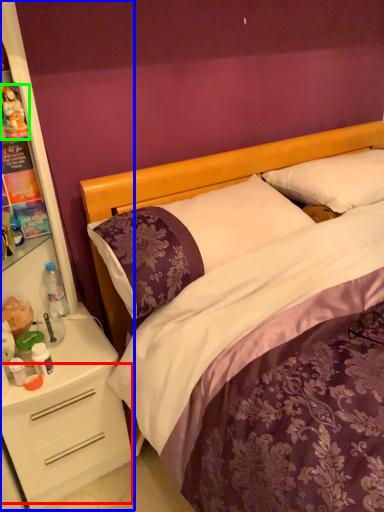
Question: Which object is positioned closest to drawer (highlighted by a red box)? Select from dresser (highlighted by a blue box) and toy (highlighted by a green box).

Choices:
 (A) dresser
 (B) toy

Answer: (A)